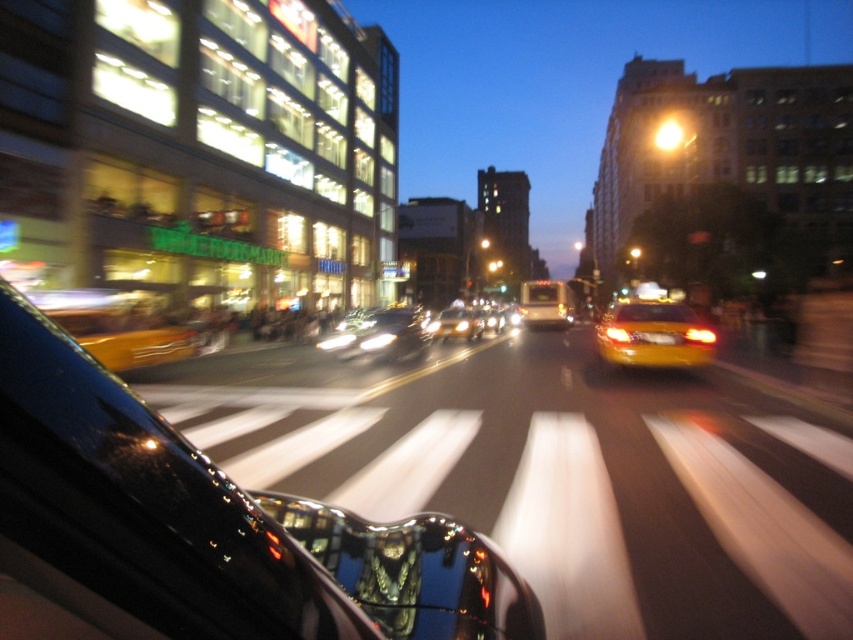
You are driving a car and want to know if you can safely stop before reaching the point at coordinates (135, 353), which is 45.70 feet away. Your car can brake at 0.7 G. What is the minimum speed you can have to stop before that point?

The minimum speed required to stop before the point at coordinates (135, 353) is calculated using the braking distance formula. With a braking force of 0.7 G and a distance of 45.70 feet, the minimum speed is approximately 45 mph.